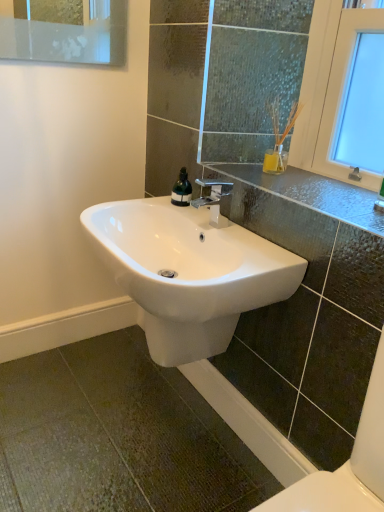
Question: From the image's perspective, is glossy ceramic sink at center positioned above or below polished chrome faucet at center?

Choices:
 (A) below
 (B) above

Answer: (B)

Question: Relative to polished chrome faucet at center, is glossy ceramic sink at center in front or behind?

Choices:
 (A) front
 (B) behind

Answer: (A)

Question: Which is nearer to the white glossy sink at center?

Choices:
 (A) green glass soap dispenser at center
 (B) polished chrome faucet at center
 (C) glossy ceramic sink at center

Answer: (B)

Question: Which is farther from the glossy ceramic sink at center?

Choices:
 (A) white glossy sink at center
 (B) polished chrome faucet at center
 (C) green glass soap dispenser at center

Answer: (C)